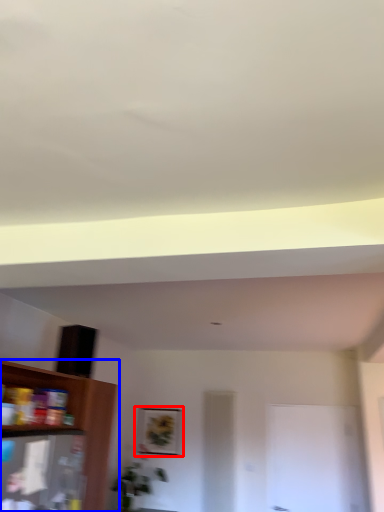
Question: Which object is further to the camera taking this photo, picture frame (highlighted by a red box) or shelf (highlighted by a blue box)?

Choices:
 (A) picture frame
 (B) shelf

Answer: (A)